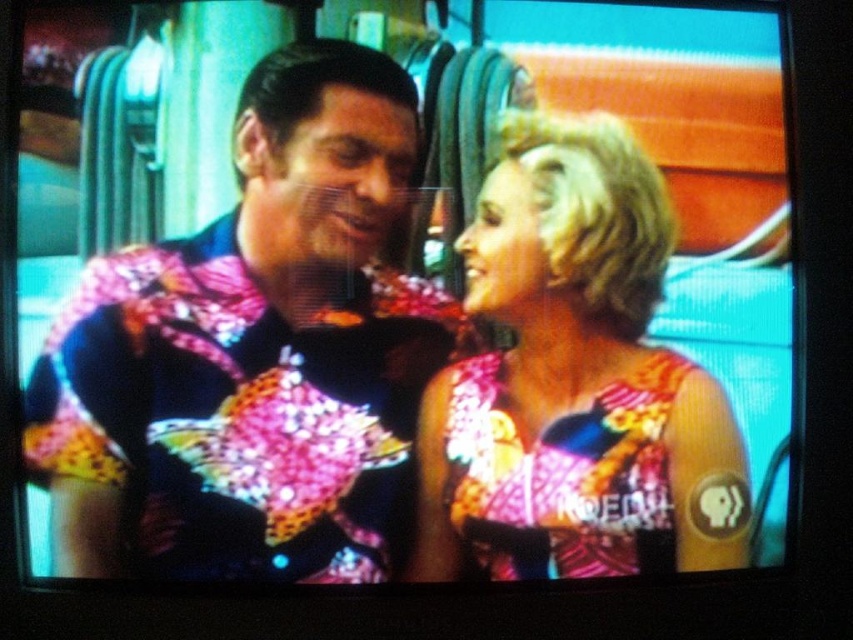
You are standing at the point labeled point (276, 60) and want to reach the door located 1.5 meters away from you. Can you walk straight ahead to the door without moving sideways?

The distance between point (276, 60) and the viewer is 1.08 meters, so if the door is 1.5 meters away, you can walk straight ahead as there is enough space between you and the door.

In the scene shown: You are a costume designer observing the two performers in the scene. You need to determine which of the two items, the shiny sequined shirt at center or the shiny sequined dress at center, has a larger width to decide which one requires more fabric for alterations. Based on the description, which one is wider?

The shiny sequined shirt at center might be wider than shiny sequined dress at center according to the description, so the shirt would require more fabric for alterations if it is indeed wider.

You are a costume designer reviewing a performance video. You need to determine if the shiny sequined shirt at center can be seen by the audience while the performer is wearing the shiny sequined dress at center. Based on their positions in the image, can you confirm if the shirt is visible?

The shiny sequined shirt at center is above the shiny sequined dress at center, so yes, the shirt would be visible to the audience as it is positioned higher than the dress.